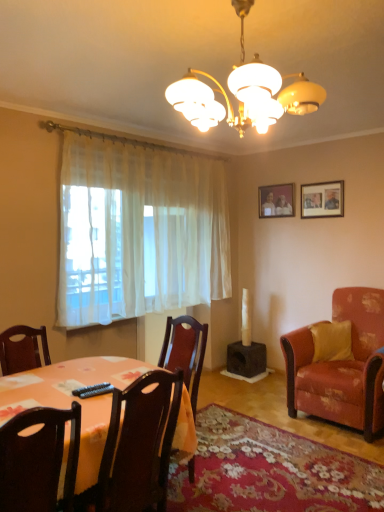
The image size is (384, 512). Identify the location of black plastic remote control at lower center. (93, 390).

Based on the photo, measure the distance between white sheer curtain at left and camera.

They are 3.18 meters apart.

The image size is (384, 512). Find the location of `orange fabric placemat at lower left`. orange fabric placemat at lower left is located at coordinates (270, 471).

Image resolution: width=384 pixels, height=512 pixels. What do you see at coordinates (270, 471) in the screenshot?
I see `orange fabric placemat at lower left` at bounding box center [270, 471].

What do you see at coordinates (342, 366) in the screenshot? The image size is (384, 512). I see `velvet orange armchair at right, positioned as the third chair in front-to-back order` at bounding box center [342, 366].

Locate an element on the screen. velvet orange armchair at right, which is counted as the 3th chair, starting from the left is located at coordinates (342, 366).

At what (x,y) coordinates should I click in order to perform the action: click on white frosted glass chandelier at upper center. Please return your answer as a coordinate pair (x, y). The width and height of the screenshot is (384, 512). Looking at the image, I should click on (244, 92).

This screenshot has height=512, width=384. Describe the element at coordinates (244, 92) in the screenshot. I see `white frosted glass chandelier at upper center` at that location.

Where is `yellow fabric pillow at right`? yellow fabric pillow at right is located at coordinates (332, 341).

Is there a large distance between dark wood chair at center, which appears as the 2th chair when viewed from the back, and velvet orange armchair at right, the first chair when ordered from right to left?

Yes.

Looking at their sizes, would you say dark wood chair at center, which appears as the 2th chair when viewed from the back, is wider or thinner than velvet orange armchair at right, which appears as the first chair when viewed from the back?

dark wood chair at center, which appears as the 2th chair when viewed from the back, is thinner than velvet orange armchair at right, which appears as the first chair when viewed from the back.

From the image's perspective, which one is positioned higher, dark wood chair at center, the second chair viewed from the right, or velvet orange armchair at right, which is counted as the 3th chair, starting from the left?

velvet orange armchair at right, which is counted as the 3th chair, starting from the left, is shown above in the image.

Is dark wood chair at center, the second chair when ordered from front to back, positioned with its back to velvet orange armchair at right, which is counted as the 3th chair, starting from the left?

Correct, dark wood chair at center, the second chair when ordered from front to back, is looking away from velvet orange armchair at right, which is counted as the 3th chair, starting from the left.

Does point (208, 115) come in front of point (370, 325)?

Yes, point (208, 115) is in front of point (370, 325).

Considering the relative sizes of white frosted glass chandelier at upper center and velvet orange armchair at right, which appears as the first chair when viewed from the back, in the image provided, is white frosted glass chandelier at upper center taller than velvet orange armchair at right, which appears as the first chair when viewed from the back,?

In fact, white frosted glass chandelier at upper center may be shorter than velvet orange armchair at right, which appears as the first chair when viewed from the back.

Is white frosted glass chandelier at upper center to the right of velvet orange armchair at right, which appears as the first chair when viewed from the back, from the viewer's perspective?

No, white frosted glass chandelier at upper center is not to the right of velvet orange armchair at right, which appears as the first chair when viewed from the back.

Consider the image. Considering the positions of objects velvet orange armchair at right, the first chair when ordered from right to left, and wooden picture frame at upper right, the first picture frame in the front-to-back sequence, in the image provided, who is more to the left, velvet orange armchair at right, the first chair when ordered from right to left, or wooden picture frame at upper right, the first picture frame in the front-to-back sequence,?

wooden picture frame at upper right, the first picture frame in the front-to-back sequence.

Does point (292, 370) appear closer or farther from the camera than point (324, 205)?

Point (292, 370) is closer to the camera than point (324, 205).

How distant is velvet orange armchair at right, which is counted as the 3th chair, starting from the left, from wooden picture frame at upper right, which is the 1th picture frame in right-to-left order?

velvet orange armchair at right, which is counted as the 3th chair, starting from the left, is 4.36 feet away from wooden picture frame at upper right, which is the 1th picture frame in right-to-left order.

From the image's perspective, is velvet orange armchair at right, which appears as the first chair when viewed from the back, positioned above or below wooden picture frame at upper right, marked as the second picture frame in a back-to-front arrangement?

From the image's perspective, velvet orange armchair at right, which appears as the first chair when viewed from the back, appears below wooden picture frame at upper right, marked as the second picture frame in a back-to-front arrangement.

From the image's perspective, is white sheer curtain at left positioned above or below dark wood chair at lower left, which is the 3th chair from right to left?

Based on their image positions, white sheer curtain at left is located above dark wood chair at lower left, which is the 3th chair from right to left.

From a real-world perspective, who is located higher, white sheer curtain at left or dark wood chair at lower left, which is the first chair from front to back?

white sheer curtain at left is physically above.

Could you tell me if white sheer curtain at left is turned towards dark wood chair at lower left, marked as the 1th chair in a left-to-right arrangement?

No, white sheer curtain at left is not oriented towards dark wood chair at lower left, marked as the 1th chair in a left-to-right arrangement.

Can we say white sheer curtain at left lies outside dark wood chair at lower left, which is the first chair from front to back?

Indeed, white sheer curtain at left is completely outside dark wood chair at lower left, which is the first chair from front to back.

Is velvet orange armchair at right, which is counted as the 3th chair, starting from the left, not within orange fabric placemat at lower left?

That's correct, velvet orange armchair at right, which is counted as the 3th chair, starting from the left, is outside of orange fabric placemat at lower left.

Is velvet orange armchair at right, positioned as the third chair in front-to-back order, positioned far away from orange fabric placemat at lower left?

No, velvet orange armchair at right, positioned as the third chair in front-to-back order, is not far away from orange fabric placemat at lower left.

Considering the positions of objects velvet orange armchair at right, which is counted as the 3th chair, starting from the left, and orange fabric placemat at lower left in the image provided, who is behind, velvet orange armchair at right, which is counted as the 3th chair, starting from the left, or orange fabric placemat at lower left?

velvet orange armchair at right, which is counted as the 3th chair, starting from the left, is more distant.

From a real-world perspective, which is physically below, dark wood chair at lower left, which ranks as the third chair in back-to-front order, or dark wood chair at center, the 2th chair viewed from the left?

In real-world perspective, dark wood chair at center, the 2th chair viewed from the left, is lower.

Is dark wood chair at lower left, which ranks as the third chair in back-to-front order, positioned with its back to dark wood chair at center, the second chair viewed from the right?

No.

Would you say dark wood chair at lower left, which ranks as the third chair in back-to-front order, is to the left or to the right of dark wood chair at center, which appears as the 2th chair when viewed from the back, in the picture?

dark wood chair at lower left, which ranks as the third chair in back-to-front order, is to the left of dark wood chair at center, which appears as the 2th chair when viewed from the back.

Is dark wood chair at lower left, which ranks as the third chair in back-to-front order, bigger or smaller than dark wood chair at center, the second chair when ordered from front to back?

dark wood chair at lower left, which ranks as the third chair in back-to-front order, is smaller than dark wood chair at center, the second chair when ordered from front to back.

Could wooden picture frame at upper right, which is the 1th picture frame in right-to-left order, be considered to be inside orange fabric placemat at lower left?

No, wooden picture frame at upper right, which is the 1th picture frame in right-to-left order, is not surrounded by orange fabric placemat at lower left.

How distant is orange fabric placemat at lower left from wooden picture frame at upper right, marked as the second picture frame in a back-to-front arrangement?

orange fabric placemat at lower left and wooden picture frame at upper right, marked as the second picture frame in a back-to-front arrangement, are 7.85 feet apart from each other.

Considering the sizes of objects orange fabric placemat at lower left and wooden picture frame at upper right, the first picture frame in the front-to-back sequence, in the image provided, who is thinner, orange fabric placemat at lower left or wooden picture frame at upper right, the first picture frame in the front-to-back sequence,?

wooden picture frame at upper right, the first picture frame in the front-to-back sequence, is thinner.

Could you tell me if orange fabric placemat at lower left is facing wooden picture frame at upper right, marked as the second picture frame in a back-to-front arrangement?

No, orange fabric placemat at lower left is not turned towards wooden picture frame at upper right, marked as the second picture frame in a back-to-front arrangement.

From a real-world perspective, count 1st chairs upward from the dark wood chair at center, the 2th chair viewed from the left, and point to it. Please provide its 2D coordinates.

[(342, 366)]

Where is `lamp in front of the velvet orange armchair at right, the first chair when ordered from right to left`? This screenshot has height=512, width=384. lamp in front of the velvet orange armchair at right, the first chair when ordered from right to left is located at coordinates (244, 92).

Looking at the image, which one is located closer to black plastic remote control at lower center, dark wood chair at center, the 2th chair viewed from the left, or velvet orange armchair at right, which appears as the first chair when viewed from the back?

The object closer to black plastic remote control at lower center is dark wood chair at center, the 2th chair viewed from the left.

Based on their spatial positions, is black plastic remote control at lower center or yellow fabric pillow at right closer to wooden photo frame at upper center, marked as the second picture frame in a right-to-left arrangement?

yellow fabric pillow at right.

Considering their positions, is yellow fabric pillow at right positioned closer to dark wood chair at lower left, which is the first chair from front to back, than white sheer curtain at left?

The object closer to dark wood chair at lower left, which is the first chair from front to back, is white sheer curtain at left.

When comparing their distances from velvet orange armchair at right, positioned as the third chair in front-to-back order, does wooden picture frame at upper right, marked as the second picture frame in a back-to-front arrangement, or black plastic remote control at lower center seem closer?

wooden picture frame at upper right, marked as the second picture frame in a back-to-front arrangement, is closer to velvet orange armchair at right, positioned as the third chair in front-to-back order.

In the scene shown: When comparing their distances from black plastic remote control at lower center, does orange fabric placemat at lower left or orange fabric table at lower left seem closer?

orange fabric table at lower left lies closer to black plastic remote control at lower center than the other object.

Which object lies nearer to the anchor point yellow fabric pillow at right, velvet orange armchair at right, the first chair when ordered from right to left, or white sheer curtain at left?

Among the two, velvet orange armchair at right, the first chair when ordered from right to left, is located nearer to yellow fabric pillow at right.

Which object lies nearer to the anchor point black plastic remote control at lower center, velvet orange armchair at right, positioned as the third chair in front-to-back order, or white sheer curtain at left?

Among the two, white sheer curtain at left is located nearer to black plastic remote control at lower center.

Considering their positions, is velvet orange armchair at right, the first chair when ordered from right to left, positioned further to orange fabric table at lower left than yellow fabric pillow at right?

Based on the image, yellow fabric pillow at right appears to be further to orange fabric table at lower left.

At what (x,y) coordinates should I click in order to perform the action: click on place mat between dark wood chair at lower left, which ranks as the third chair in back-to-front order, and velvet orange armchair at right, positioned as the third chair in front-to-back order, in the horizontal direction. Please return your answer as a coordinate pair (x, y). The height and width of the screenshot is (512, 384). Looking at the image, I should click on (270, 471).

I want to click on lamp between dark wood chair at lower left, which is the 3th chair from right to left, and white sheer curtain at left, along the z-axis, so click(x=244, y=92).

The width and height of the screenshot is (384, 512). Find the location of `chair located between black plastic remote control at lower center and yellow fabric pillow at right in the left-right direction`. chair located between black plastic remote control at lower center and yellow fabric pillow at right in the left-right direction is located at coordinates (140, 444).

Locate an element on the screen. This screenshot has width=384, height=512. place mat between orange fabric table at lower left and velvet orange armchair at right, the first chair when ordered from right to left is located at coordinates (270, 471).